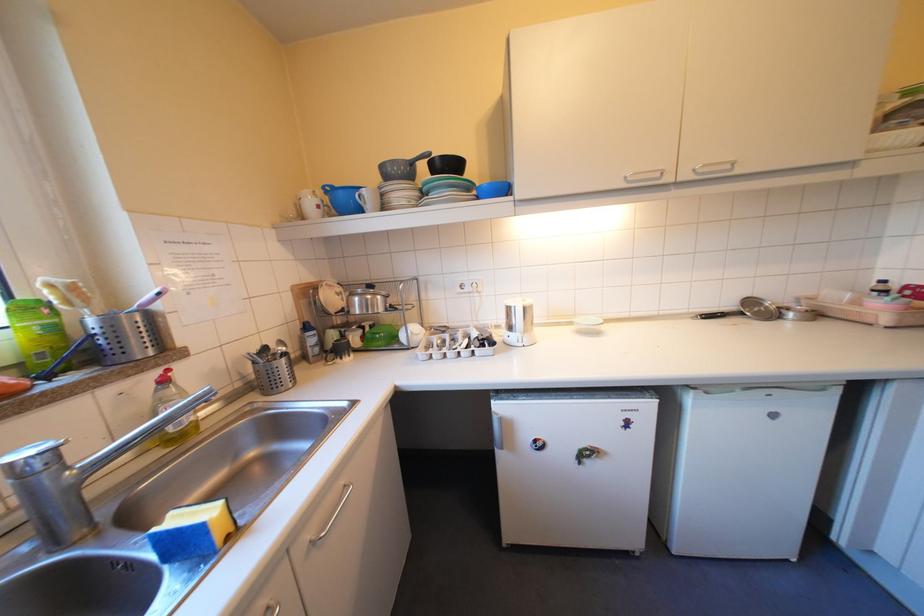
Image resolution: width=924 pixels, height=616 pixels. What do you see at coordinates (165, 383) in the screenshot?
I see `the dish soap pump` at bounding box center [165, 383].